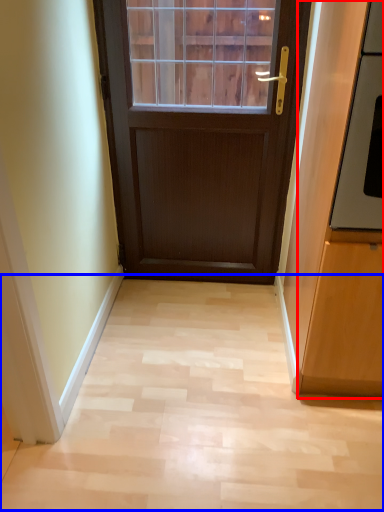
Question: Which of the following is the farthest to the observer, cabinetry (highlighted by a red box) or corridor (highlighted by a blue box)?

Choices:
 (A) cabinetry
 (B) corridor

Answer: (B)